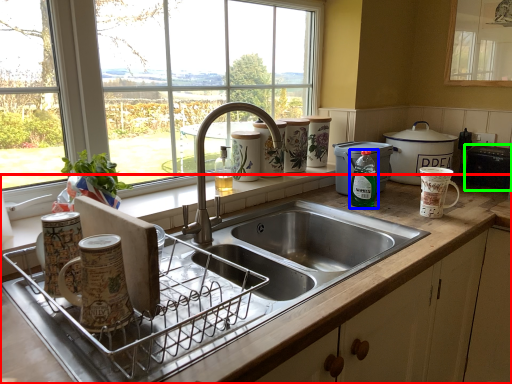
Question: Which object is positioned closest to countertop (highlighted by a red box)? Select from bottle (highlighted by a blue box) and appliance (highlighted by a green box).

Choices:
 (A) bottle
 (B) appliance

Answer: (A)